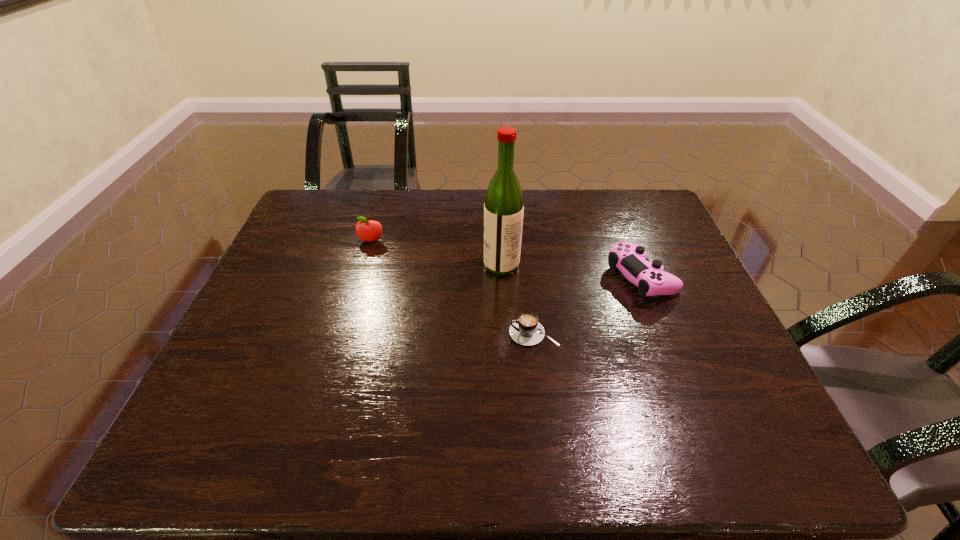
The image size is (960, 540). What are the coordinates of `vacant area located on the right of the apple` in the screenshot? It's located at (461, 241).

Find the location of a particular element. The height and width of the screenshot is (540, 960). vacant region located 0.070m on the back of the control is located at coordinates (626, 238).

Locate an element on the screen. free space located with the handle on the side of the shortest object is located at coordinates (410, 333).

Find the location of `vacant space situated with the handle on the side of the shortest object`. vacant space situated with the handle on the side of the shortest object is located at coordinates (410, 333).

At what (x,y) coordinates should I click in order to perform the action: click on vacant space located 0.120m with the handle on the side of the shortest object. Please return your answer as a coordinate pair (x, y). Looking at the image, I should click on (460, 333).

Where is `object that is at the right edge`? object that is at the right edge is located at coordinates (630, 258).

Identify the location of free region at the far edge of the desktop. This screenshot has width=960, height=540. (371, 203).

In the image, there is a desktop. Where is `vacant space at the near edge`? The width and height of the screenshot is (960, 540). vacant space at the near edge is located at coordinates (368, 448).

Locate an element on the screen. Image resolution: width=960 pixels, height=540 pixels. vacant space at the left edge is located at coordinates (278, 259).

At what (x,y) coordinates should I click in order to perform the action: click on vacant position at the right edge of the desktop. Please return your answer as a coordinate pair (x, y). This screenshot has width=960, height=540. Looking at the image, I should click on (663, 237).